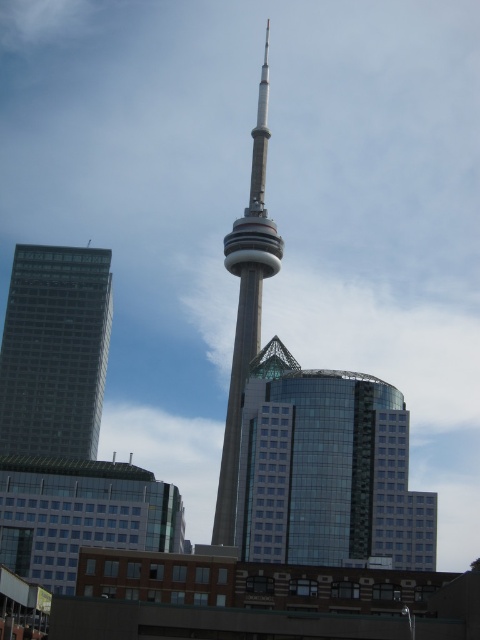
Question: Which of the following is the closest to the observer?

Choices:
 (A) (40, 400)
 (B) (245, 332)

Answer: (A)

Question: Among these objects, which one is nearest to the camera?

Choices:
 (A) green glass building at left
 (B) glassy steel tower at center

Answer: (B)

Question: Does green glass building at left appear on the right side of glassy steel tower at center?

Choices:
 (A) yes
 (B) no

Answer: (B)

Question: Is green glass building at left behind glassy steel tower at center?

Choices:
 (A) no
 (B) yes

Answer: (B)

Question: Does green glass building at left have a lesser width compared to glassy steel tower at center?

Choices:
 (A) yes
 (B) no

Answer: (B)